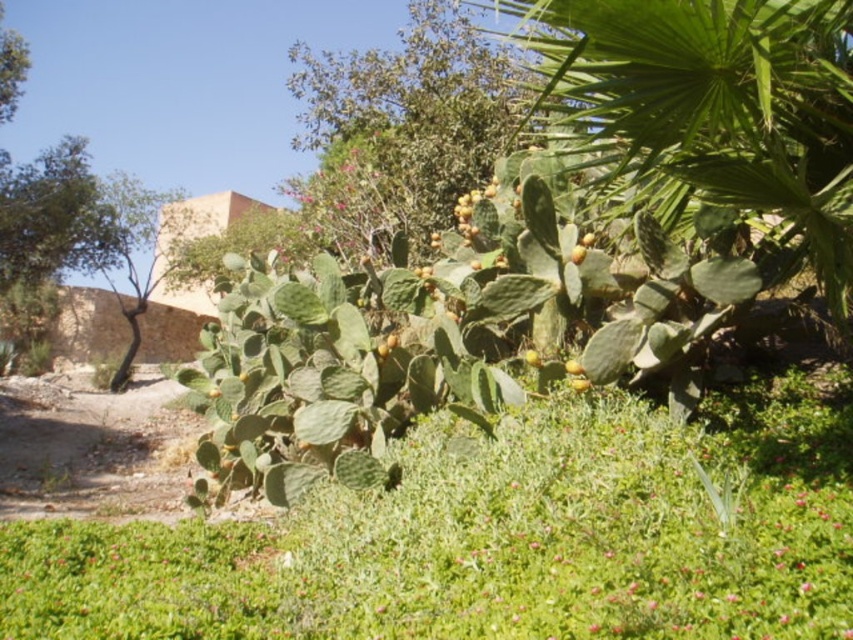
Question: Can you confirm if green leafy grass at center is smaller than yellow matte fruit at center?

Choices:
 (A) yes
 (B) no

Answer: (B)

Question: Which point is closer to the camera?

Choices:
 (A) (585, 250)
 (B) (428, 604)
 (C) (848, 140)

Answer: (B)

Question: Which object is the closest to the yellow matte fruit at center?

Choices:
 (A) green spiny cactus at center
 (B) green leafy grass at center

Answer: (B)

Question: Is green leafy palm at upper right further to camera compared to yellow matte fruit at center?

Choices:
 (A) no
 (B) yes

Answer: (A)

Question: Among these objects, which one is nearest to the camera?

Choices:
 (A) green spiny cactus at center
 (B) green leafy grass at center

Answer: (B)

Question: Observing the image, what is the correct spatial positioning of green leafy grass at center in reference to yellow matte fruit at center?

Choices:
 (A) above
 (B) below

Answer: (B)